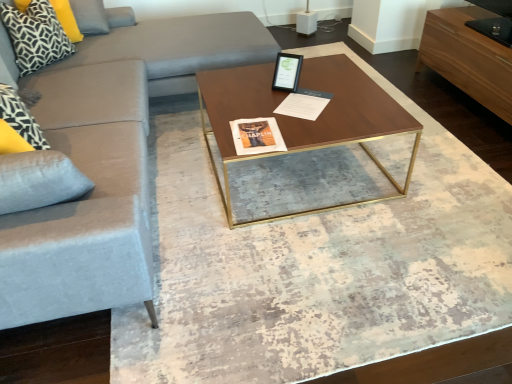
I want to click on free space below white paper at center (from a real-world perspective), so click(x=302, y=99).